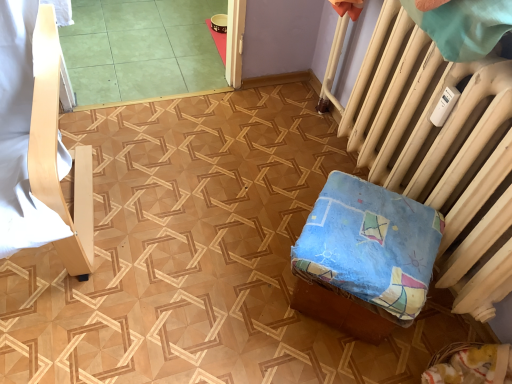
Find the location of a particular element. The width and height of the screenshot is (512, 384). space that is in front of blue fabric cushion at lower right, which appears as the first furniture when viewed from the right is located at coordinates (332, 363).